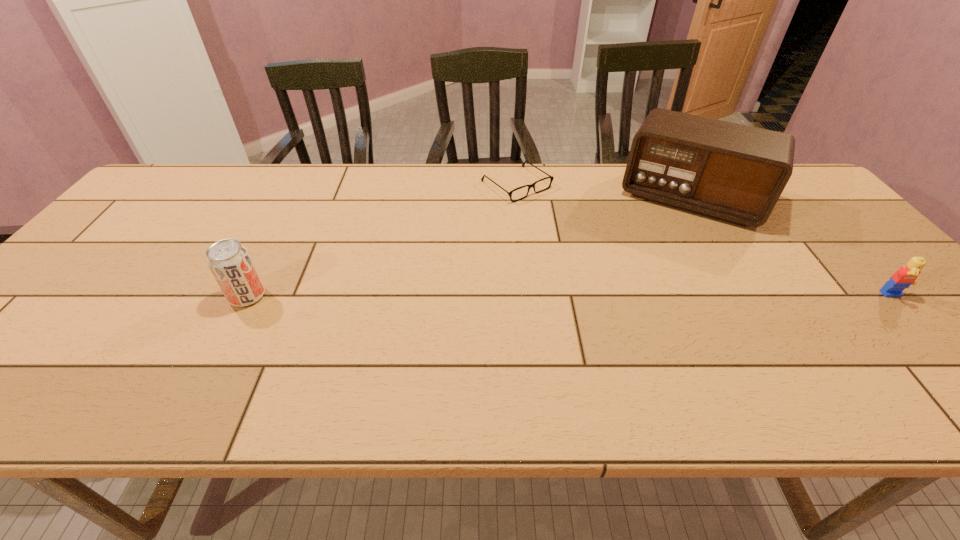
Find the location of `free space on the desktop that is between the leftmost object and the rightmost object and is positioned on the front-facing side of the second object from left to right`. free space on the desktop that is between the leftmost object and the rightmost object and is positioned on the front-facing side of the second object from left to right is located at coordinates (663, 296).

I want to click on vacant space on the desktop that is between the leftmost object and the Lego and is positioned on the front-facing side of the tallest object, so click(655, 296).